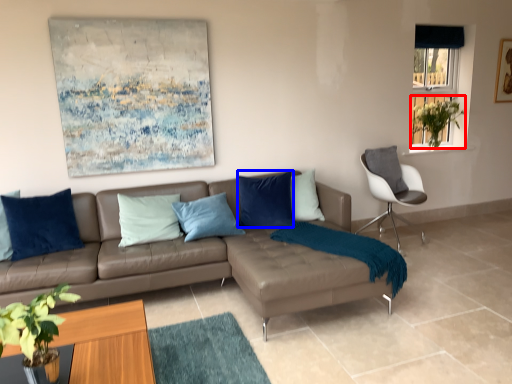
Question: Which object is further to the camera taking this photo, plant (highlighted by a red box) or pillow (highlighted by a blue box)?

Choices:
 (A) plant
 (B) pillow

Answer: (A)